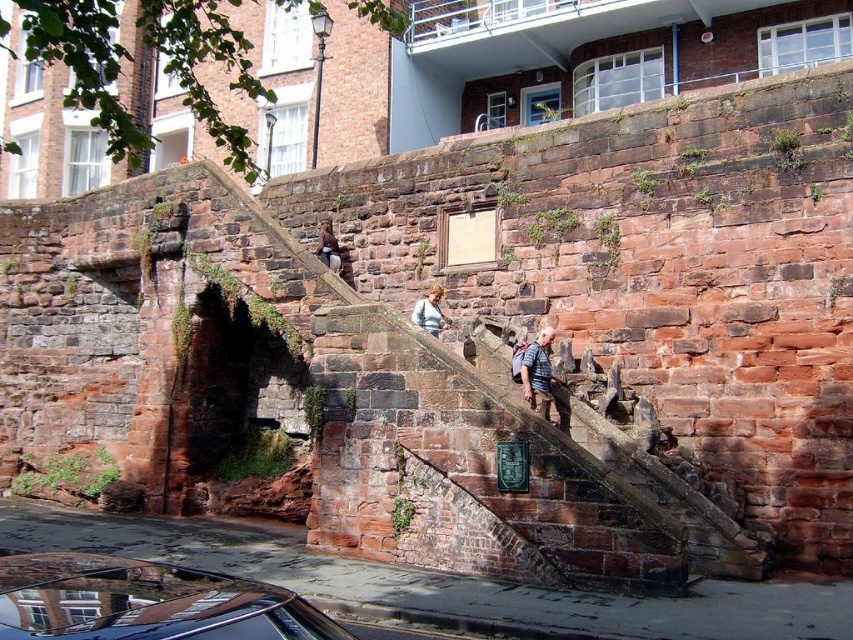
Question: Which point is closer to the camera?

Choices:
 (A) (91, 625)
 (B) (521, 358)

Answer: (A)

Question: Is brown leather jacket at lower center bigger than smooth gray sweater at center?

Choices:
 (A) no
 (B) yes

Answer: (A)

Question: Which object is the closest to the smooth gray sweater at center?

Choices:
 (A) shiny black car at lower left
 (B) brown leather jacket at center

Answer: (B)

Question: Is shiny black car at lower left thinner than smooth gray sweater at center?

Choices:
 (A) no
 (B) yes

Answer: (A)

Question: Considering the relative positions of brown leather jacket at lower center and brown leather jacket at center in the image provided, where is brown leather jacket at lower center located with respect to brown leather jacket at center?

Choices:
 (A) right
 (B) left

Answer: (A)

Question: Estimate the real-world distances between objects in this image. Which object is farther from the brown leather jacket at lower center?

Choices:
 (A) brown leather jacket at center
 (B) shiny black car at lower left
 (C) smooth gray sweater at center

Answer: (B)